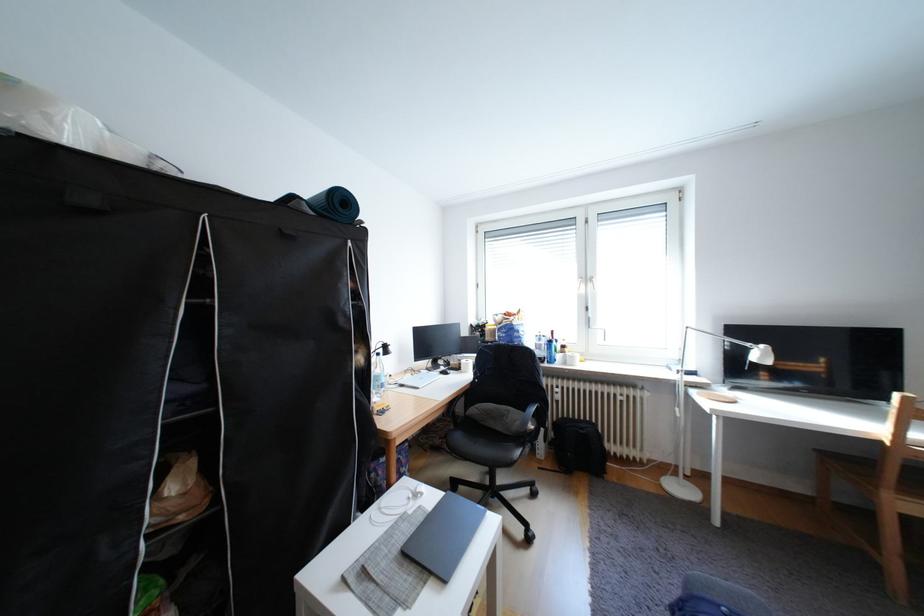
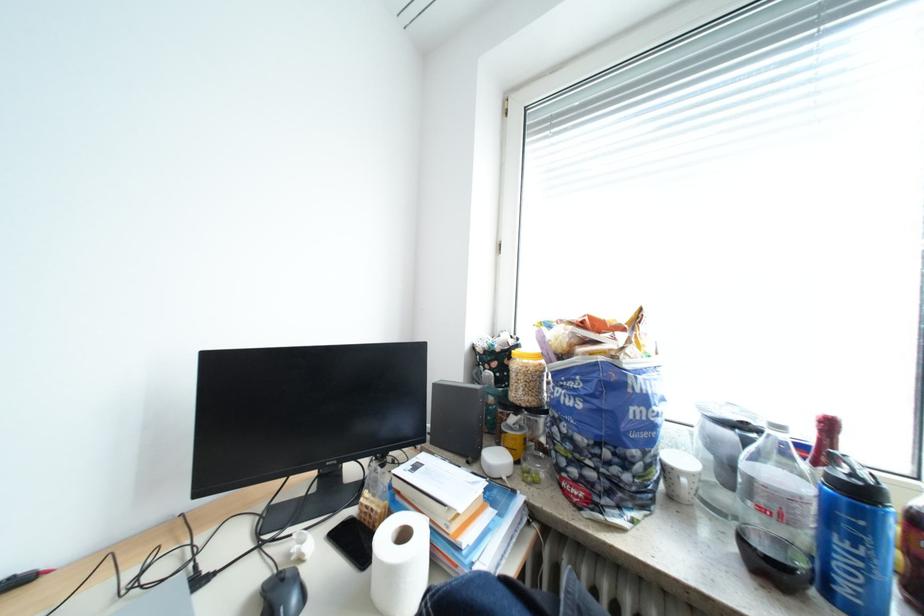
Where in the second image is the point corresponding to the point at 500,339 from the first image?

(529, 394)